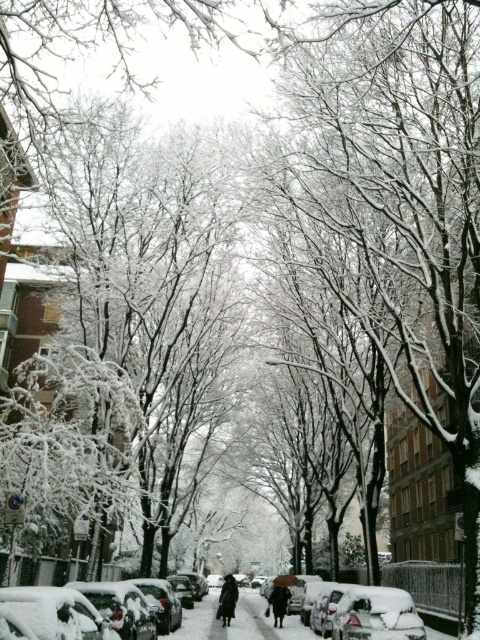
Can you confirm if snow-covered car at lower center is positioned to the left of black matte coat at center?

In fact, snow-covered car at lower center is to the right of black matte coat at center.

Can you confirm if snow-covered car at lower center is smaller than black matte coat at center?

Actually, snow-covered car at lower center might be larger than black matte coat at center.

Is point (237, 637) positioned behind point (232, 596)?

No.

Locate an element on the screen. snow-covered car at lower center is located at coordinates (264, 621).

Locate an element on the screen. black matte coat at center is located at coordinates (228, 600).

Can you confirm if black matte coat at center is shorter than dark brown coat at center?

Yes.

Who is more forward, (226, 588) or (275, 616)?

Point (226, 588) is more forward.

Where is `black matte coat at center`? The image size is (480, 640). black matte coat at center is located at coordinates (228, 600).

Does white matte car at center have a lesser height compared to dark brown coat at center?

Yes, white matte car at center is shorter than dark brown coat at center.

Is point (355, 602) positioned after point (275, 596)?

That is False.

Does point (404, 624) come in front of point (282, 611)?

Yes, it is.

Image resolution: width=480 pixels, height=640 pixels. What are the coordinates of `white matte car at center` in the screenshot? It's located at (376, 614).